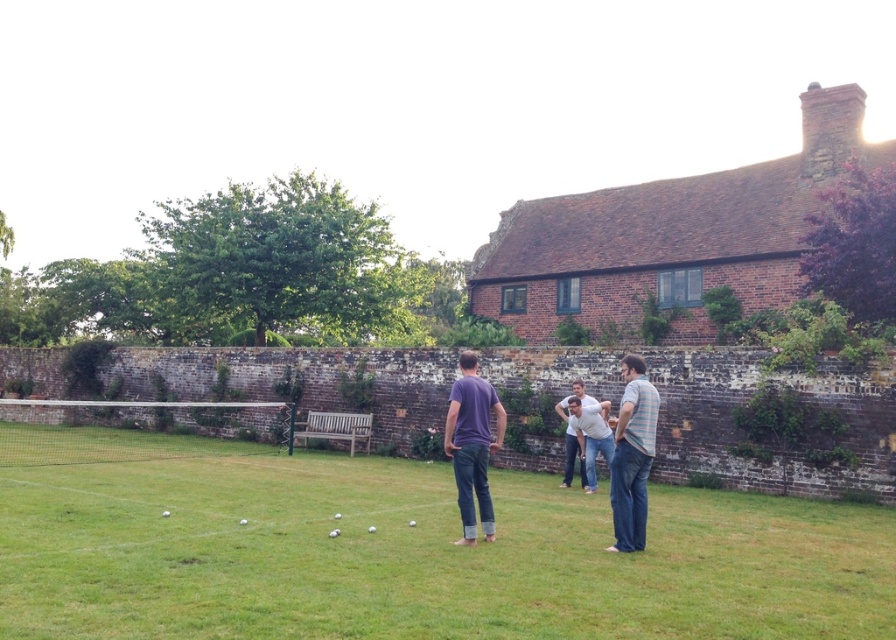
You are standing at the edge of the garden near the brick building and want to walk to the green grass at center. Which direction should you move to reach it?

The green grass at center is located at point [402,550], so you should move towards the center of the garden to reach it.

You are standing in the garden scene and see both the purple cotton shirt at center and the striped cotton shirt at center. Which one is positioned more to the left side?

The purple cotton shirt at center is positioned more to the left side than the striped cotton shirt at center.